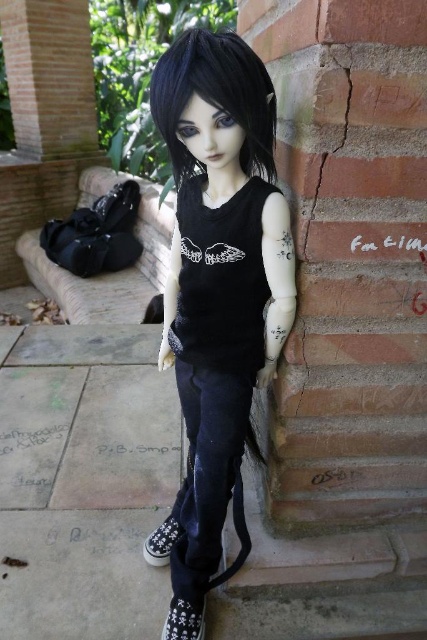
You are a photographer trying to capture the matte black doll at center and the white fabric shoe at lower center in a single frame. Which object should you focus on first to ensure both are in focus?

The matte black doll at center is closer to the viewer than the white fabric shoe at lower center. To ensure both are in focus, you should focus on the matte black doll at center first, as focusing on the closer object will help the camera adjust depth of field to include the farther object.

You are a photographer setting up a shot of the matte black doll at center and the black canvas shoe at lower left. You want to ensure both subjects are in focus. Given their sizes, which subject should you focus on first to achieve proper depth of field?

The matte black doll at center is much taller than the black canvas shoe at lower left, so you should focus on the matte black doll at center first since it is larger and requires more attention to detail for depth of field.